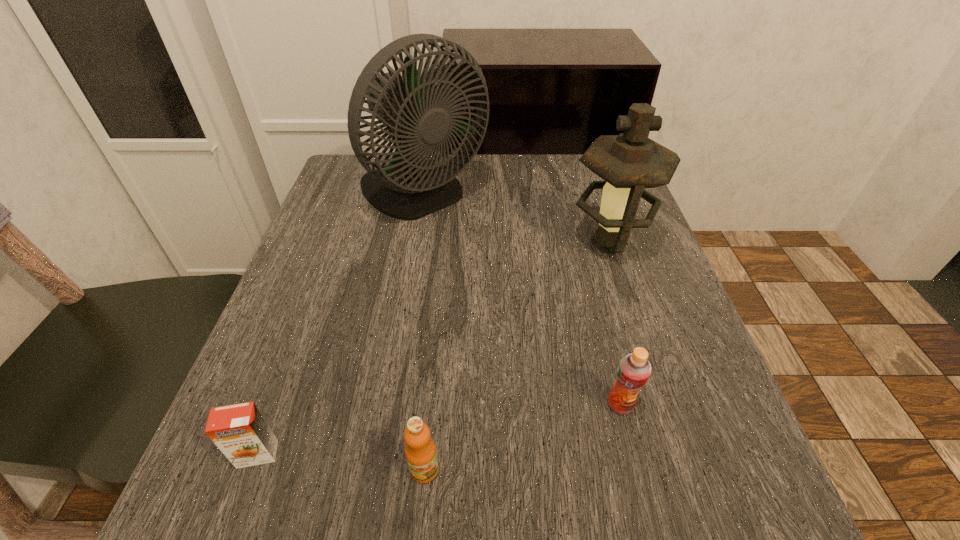
Where is `blank area in the image that satisfies the following two spatial constraints: 1. in front of the fourth shortest object to direct airflow; 2. on the left side of the fan`? The image size is (960, 540). blank area in the image that satisfies the following two spatial constraints: 1. in front of the fourth shortest object to direct airflow; 2. on the left side of the fan is located at coordinates (415, 243).

Image resolution: width=960 pixels, height=540 pixels. I want to click on free location that satisfies the following two spatial constraints: 1. in front of the second tallest object to direct airflow; 2. on the left side of the fan, so click(415, 243).

What are the coordinates of `free location that satisfies the following two spatial constraints: 1. on the back side of the third farthest object; 2. on the left side of the shortest object` in the screenshot? It's located at 276,404.